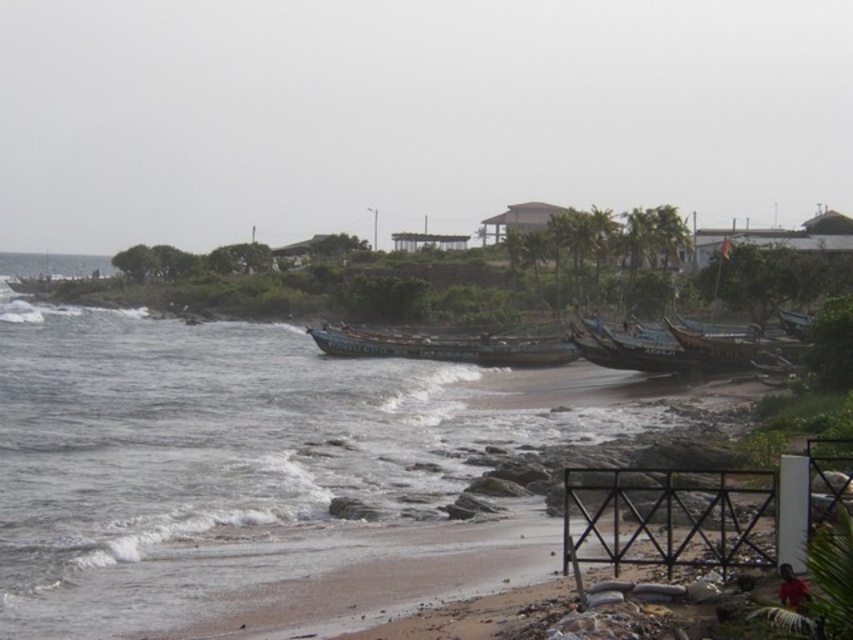
You are a photographer planning to capture the entire scene in one shot. Given that the blue water at lower left and the green painted wooden boat at center are both in your frame, which one would occupy more space in the photo?

The blue water at lower left occupies more space in the photo because it is described as bigger than the green painted wooden boat at center.

You are standing on the beach and want to take a photo of both the blue water at lower left and the green painted wooden boat at center. Which object should you focus on first to ensure it appears sharp in your photo?

You should focus on the blue water at lower left first because it is closer to you than the green painted wooden boat at center, so focusing on the closer object ensures it will be sharp.